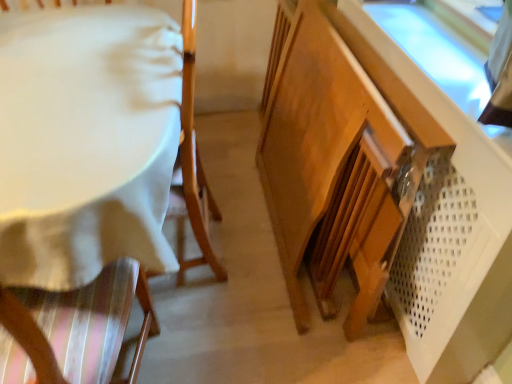
What are the coordinates of `vacant region above wooden cabinet at lower right (from a real-world perspective)` in the screenshot? It's located at (422, 37).